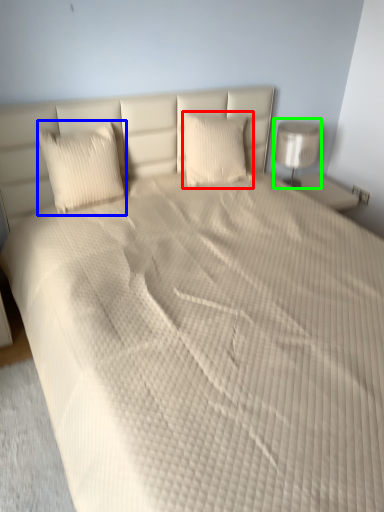
Question: Which is nearer to the pillow (highlighted by a red box)? pillow (highlighted by a blue box) or lamp (highlighted by a green box).

Choices:
 (A) pillow
 (B) lamp

Answer: (B)